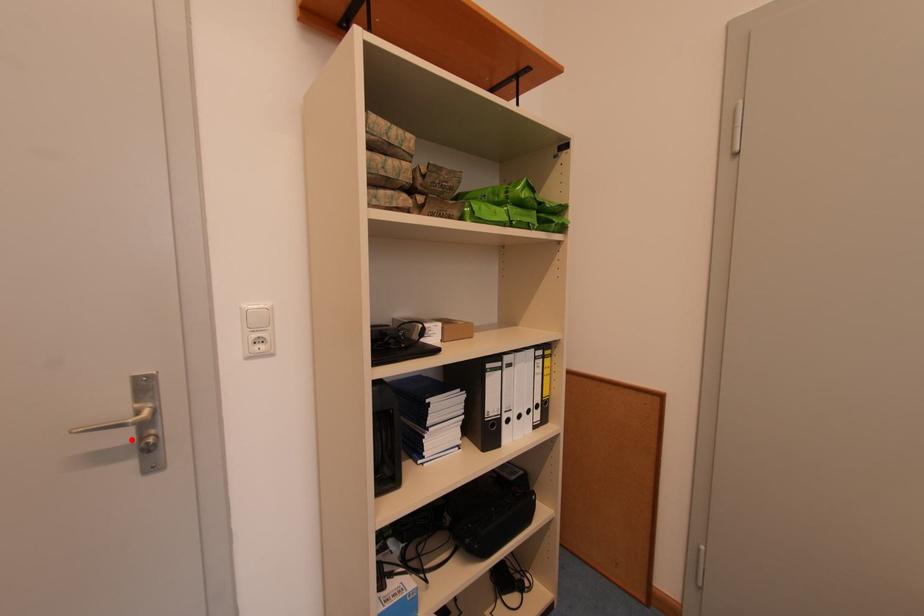
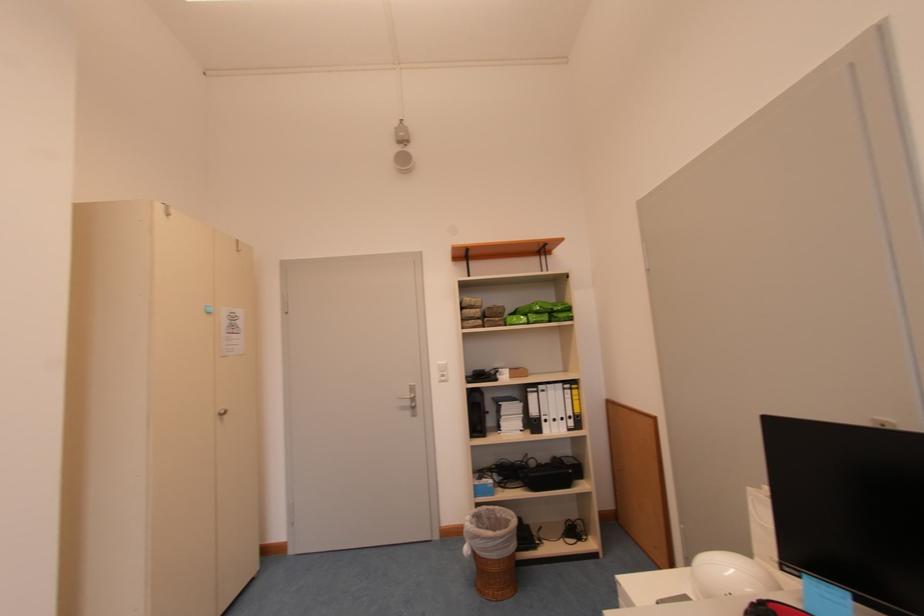
Question: I am providing you with two images of the same scene from different viewpoints. Image1 has a red point marked. In image2, the corresponding 3D location appears at what relative position? Reply with the corresponding letter.

Choices:
 (A) Closer
 (B) Farther

Answer: (B)